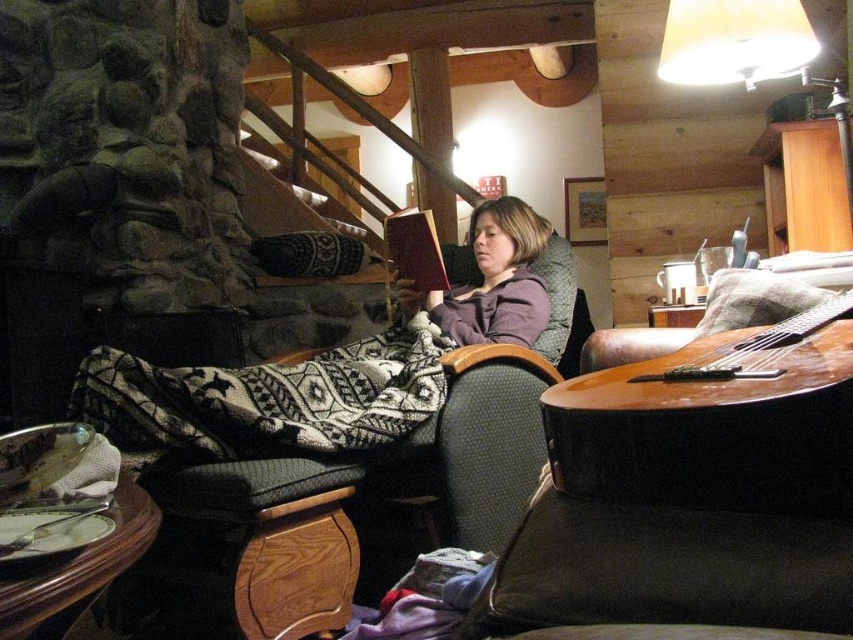
Question: Which is nearer to the knitted wool blanket at center?

Choices:
 (A) soft purple sweater at center
 (B) velvet-like dark brown pillow at center

Answer: (A)

Question: Among these points, which one is farthest from the camera?

Choices:
 (A) (300, 260)
 (B) (234, 547)
 (C) (195, 426)
 (D) (125, 365)

Answer: (A)

Question: Which point appears closest to the camera in this image?

Choices:
 (A) (209, 500)
 (B) (280, 369)

Answer: (A)

Question: Can you confirm if knitted wool blanket at center is positioned to the right of velvet-like dark brown pillow at center?

Choices:
 (A) yes
 (B) no

Answer: (A)

Question: Can you confirm if knitted wool blanket at center is positioned below velvet-like dark brown pillow at center?

Choices:
 (A) yes
 (B) no

Answer: (A)

Question: Where is soft purple sweater at center located in relation to dark brown wooden stool at lower left in the image?

Choices:
 (A) below
 (B) above

Answer: (B)